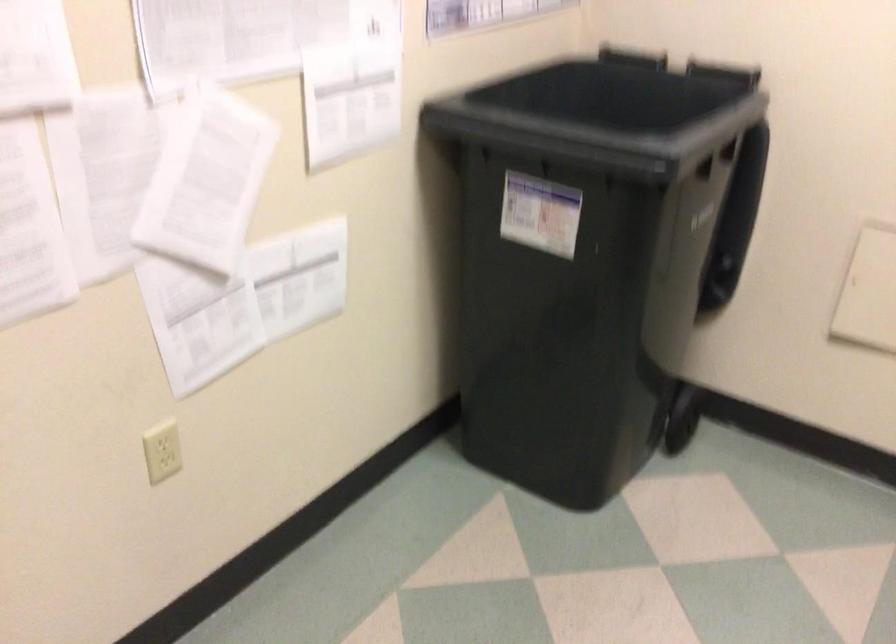
This screenshot has height=644, width=896. What are the coordinates of `bin lid handle` in the screenshot? It's located at (742, 209).